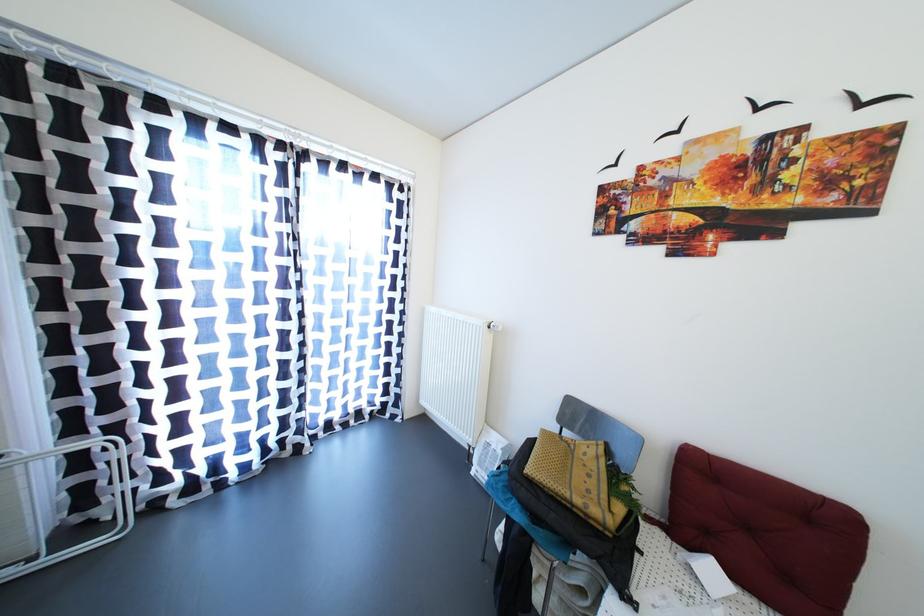
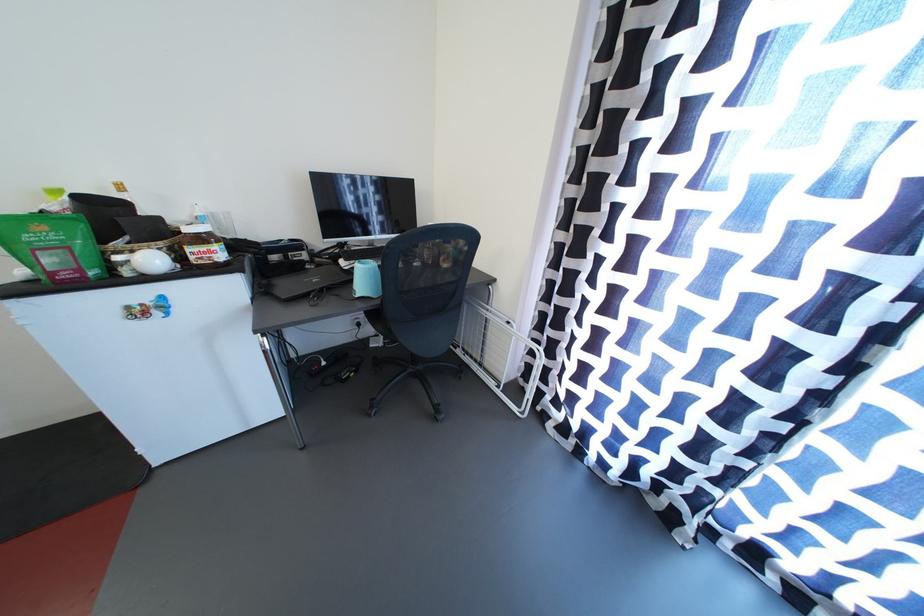
The images are taken continuously from a first-person perspective. In which direction is your viewpoint rotating?

The camera rotated toward left-down.